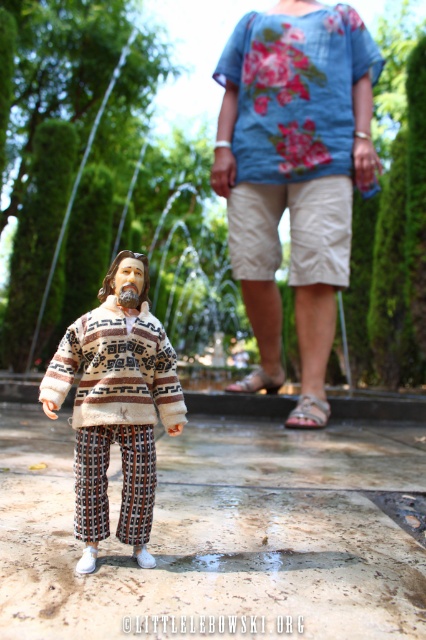
You are an observer looking at the scene. You notice two items in the foreground of the image. The first is the knitted wool sweater at center, and the second is the blue floral fabric shirt at upper center. Which of these items is positioned higher up in the image?

The blue floral fabric shirt at upper center is positioned higher up in the image than the knitted wool sweater at center.